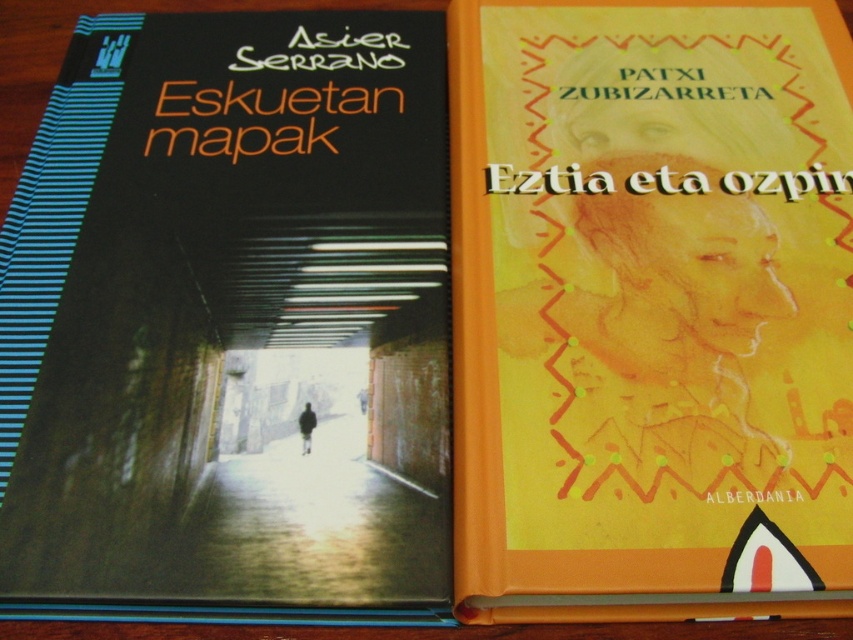
Which is behind, point (274, 515) or point (674, 429)?

The point (674, 429) is behind.

Does black matte book cover at center lie behind orange matte book at right?

Yes, black matte book cover at center is further from the viewer.

This screenshot has width=853, height=640. I want to click on black matte book cover at center, so click(230, 324).